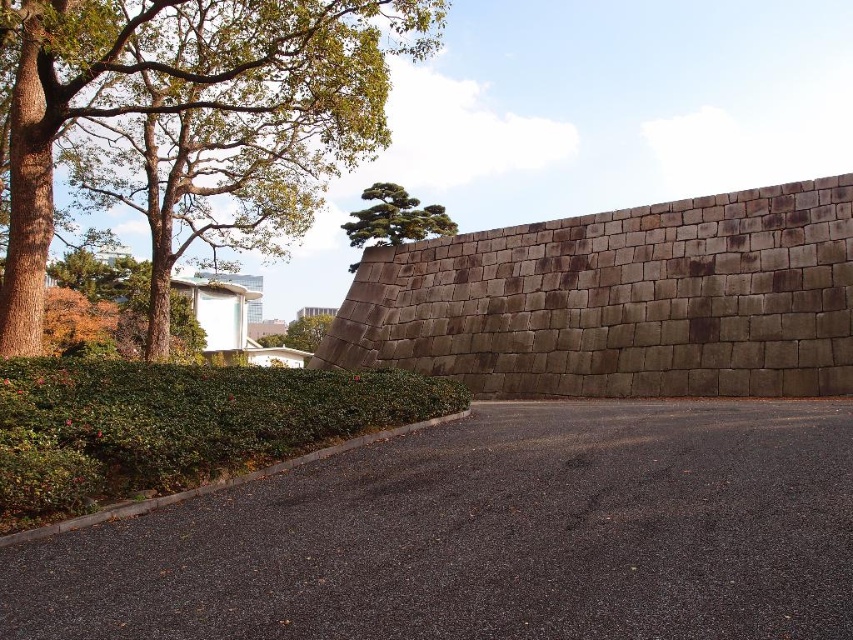
Looking at this image, you are a landscape architect designing a garden and want to place both the green leafy hedge at lower left and the green leafy tree at center in your design. Which one should you allocate more space for?

The green leafy tree at center requires more space since it occupies more area than the green leafy hedge at lower left.

You are standing on the paved road and want to walk towards the green leafy tree at center. Which direction should you walk to avoid the green leafy hedge at lower left?

The green leafy hedge at lower left is to the right of the green leafy tree at center, so to avoid it, you should walk towards the left side of the image to reach the tree without encountering the hedge.